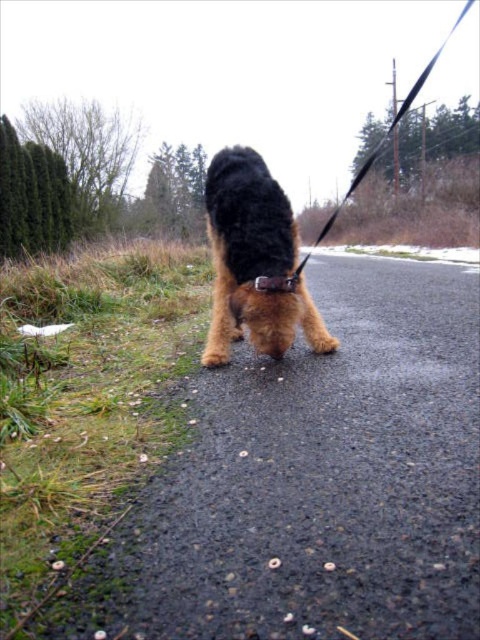
Question: Which of the following is the closest to the observer?

Choices:
 (A) (235, 435)
 (B) (255, 284)

Answer: (A)

Question: Does brown fur dog at center have a greater width compared to shaggy brown dog at center?

Choices:
 (A) yes
 (B) no

Answer: (A)

Question: Which object is closer to the camera taking this photo?

Choices:
 (A) black leather collar at center
 (B) shaggy brown dog at center
 (C) brown fur dog at center

Answer: (C)

Question: Does brown fur dog at center appear over shaggy brown dog at center?

Choices:
 (A) no
 (B) yes

Answer: (A)

Question: Does shaggy brown dog at center appear under black leather collar at center?

Choices:
 (A) yes
 (B) no

Answer: (B)

Question: Which point is farther to the camera?

Choices:
 (A) (276, 280)
 (B) (300, 426)

Answer: (A)